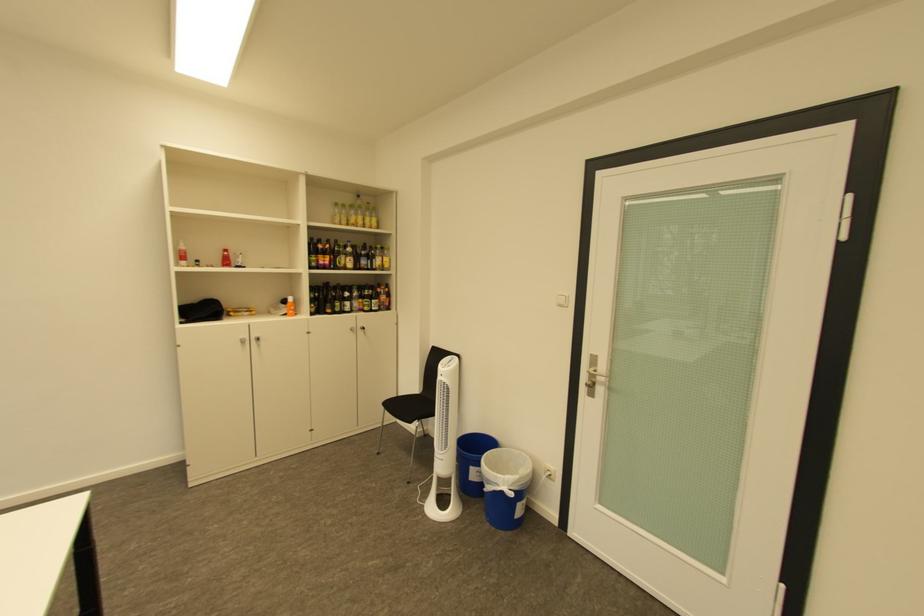
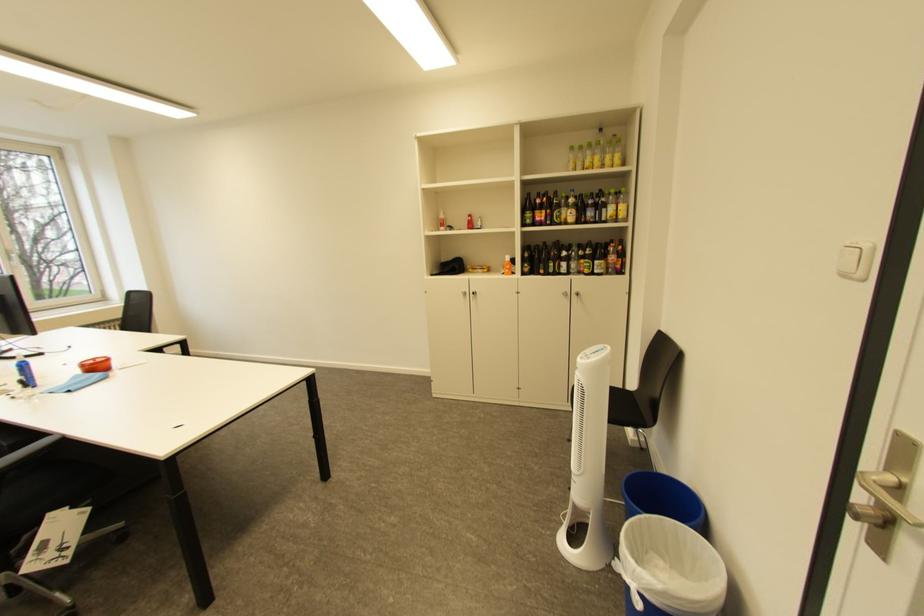
Find the pixel in the second image that matches [600,369] in the first image.

(898, 472)